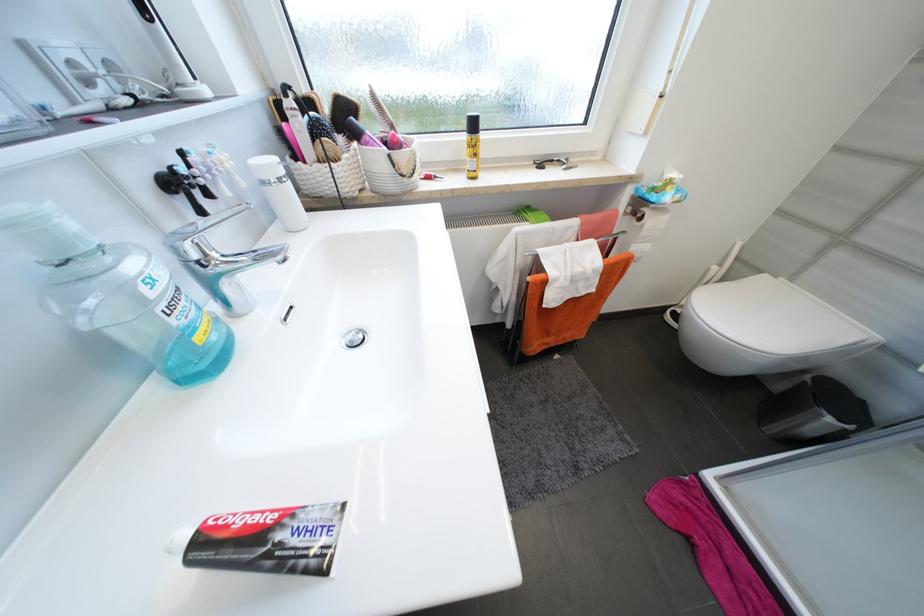
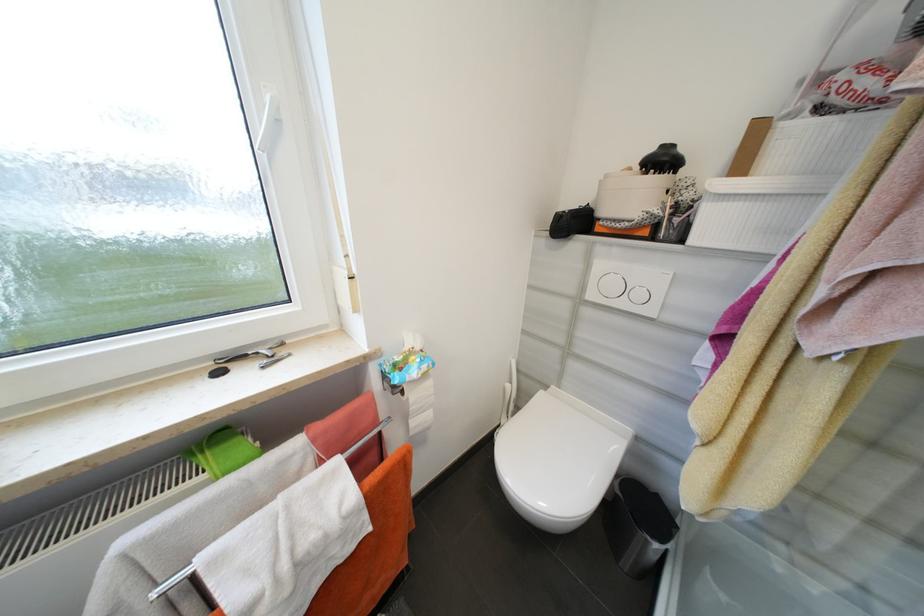
In the second image, find the point that corresponds to point 565,161 in the first image.

(262, 354)